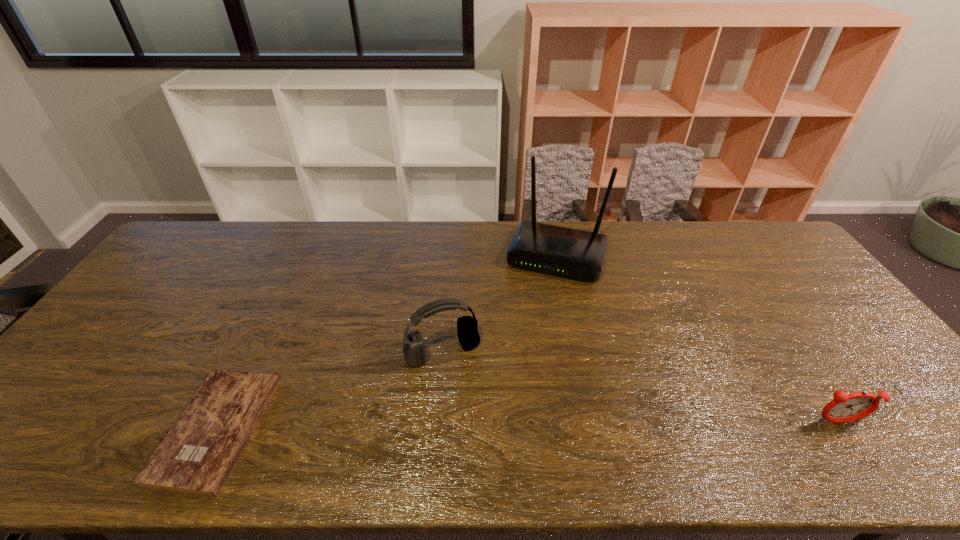
Identify the location of free area in between the rightmost object and the third shortest object. Image resolution: width=960 pixels, height=540 pixels. (640, 387).

Where is `blank region between the tallest object and the third shortest object`? This screenshot has height=540, width=960. blank region between the tallest object and the third shortest object is located at coordinates (499, 303).

The image size is (960, 540). In order to click on vacant region between the second object from right to left and the headset in this screenshot , I will do `click(499, 303)`.

Identify the location of free space between the leftmost object and the rightmost object. (527, 426).

The width and height of the screenshot is (960, 540). I want to click on free space between the second shortest object and the third shortest object, so click(640, 387).

Locate an element on the screen. The width and height of the screenshot is (960, 540). free space between the Bible and the third shortest object is located at coordinates (330, 390).

Image resolution: width=960 pixels, height=540 pixels. What are the coordinates of `empty space between the leftmost object and the second object from left to right` in the screenshot? It's located at (330, 390).

Where is `vacant space that's between the alarm clock and the farthest object`? This screenshot has height=540, width=960. vacant space that's between the alarm clock and the farthest object is located at coordinates (697, 339).

Locate an element on the screen. The width and height of the screenshot is (960, 540). empty space between the third object from left to right and the second shortest object is located at coordinates (697, 339).

Where is `free space between the shortest object and the third tallest object`? free space between the shortest object and the third tallest object is located at coordinates (527, 426).